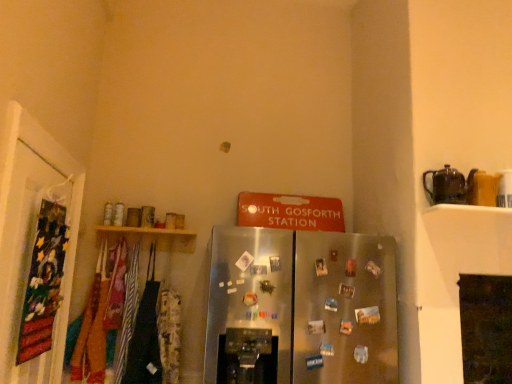
Question: From a real-world perspective, is satin silver refrigerator at center on velvet fabric banner at left?

Choices:
 (A) yes
 (B) no

Answer: (B)

Question: Can you confirm if satin silver refrigerator at center is positioned to the right of velvet fabric banner at left?

Choices:
 (A) no
 (B) yes

Answer: (B)

Question: Is satin silver refrigerator at center positioned with its back to velvet fabric banner at left?

Choices:
 (A) yes
 (B) no

Answer: (B)

Question: Does satin silver refrigerator at center have a lesser width compared to velvet fabric banner at left?

Choices:
 (A) no
 (B) yes

Answer: (A)

Question: Can you confirm if satin silver refrigerator at center is bigger than velvet fabric banner at left?

Choices:
 (A) yes
 (B) no

Answer: (A)

Question: In terms of width, does brown ceramic teapot at upper right look wider or thinner when compared to velvet fabric banner at left?

Choices:
 (A) thin
 (B) wide

Answer: (B)

Question: In terms of height, does brown ceramic teapot at upper right look taller or shorter compared to velvet fabric banner at left?

Choices:
 (A) short
 (B) tall

Answer: (A)

Question: Considering the relative positions of brown ceramic teapot at upper right and velvet fabric banner at left in the image provided, is brown ceramic teapot at upper right to the left or to the right of velvet fabric banner at left?

Choices:
 (A) right
 (B) left

Answer: (A)

Question: From the image's perspective, is brown ceramic teapot at upper right above or below velvet fabric banner at left?

Choices:
 (A) below
 (B) above

Answer: (B)

Question: Is point (18, 379) closer or farther from the camera than point (395, 331)?

Choices:
 (A) farther
 (B) closer

Answer: (B)

Question: From the image's perspective, is velvet fabric banner at left located above or below satin silver refrigerator at center?

Choices:
 (A) below
 (B) above

Answer: (B)

Question: From a real-world perspective, relative to satin silver refrigerator at center, is velvet fabric banner at left vertically above or below?

Choices:
 (A) below
 (B) above

Answer: (B)

Question: Which is correct: velvet fabric banner at left is inside satin silver refrigerator at center, or outside of it?

Choices:
 (A) inside
 (B) outside

Answer: (B)

Question: In terms of height, does satin silver refrigerator at center look taller or shorter compared to brown ceramic teapot at upper right?

Choices:
 (A) tall
 (B) short

Answer: (A)

Question: From the image's perspective, is satin silver refrigerator at center located above or below brown ceramic teapot at upper right?

Choices:
 (A) below
 (B) above

Answer: (A)